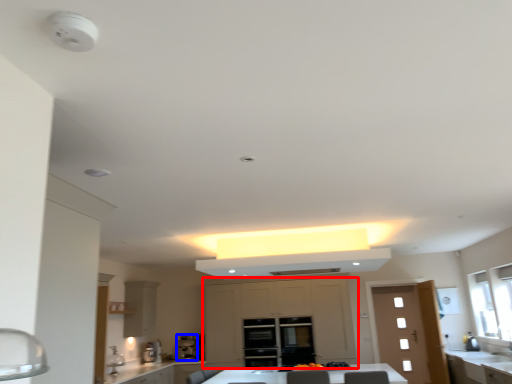
Question: Which point is closer to the camera, cabinetry (highlighted by a red box) or coffee machine (highlighted by a blue box)?

Choices:
 (A) cabinetry
 (B) coffee machine

Answer: (A)